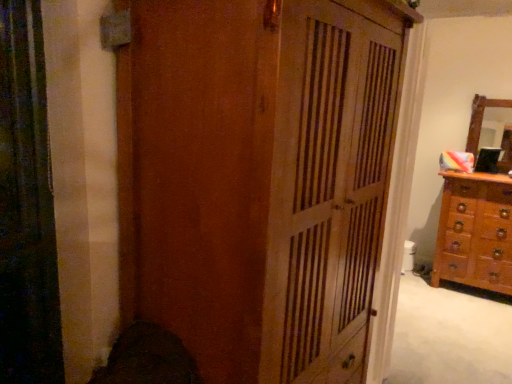
Question: From the image's perspective, is wooden mirror at right under wooden chest of drawers at right?

Choices:
 (A) yes
 (B) no

Answer: (B)

Question: Is wooden mirror at right positioned far away from wooden chest of drawers at right?

Choices:
 (A) no
 (B) yes

Answer: (A)

Question: Is wooden mirror at right positioned beyond the bounds of wooden chest of drawers at right?

Choices:
 (A) yes
 (B) no

Answer: (A)

Question: Can you confirm if wooden mirror at right is positioned to the right of wooden chest of drawers at right?

Choices:
 (A) yes
 (B) no

Answer: (A)

Question: Can you confirm if wooden mirror at right is thinner than wooden chest of drawers at right?

Choices:
 (A) no
 (B) yes

Answer: (B)

Question: Is wooden mirror at right with wooden chest of drawers at right?

Choices:
 (A) yes
 (B) no

Answer: (B)

Question: From a real-world perspective, does wooden chest of drawers at right sit lower than wooden mirror at right?

Choices:
 (A) no
 (B) yes

Answer: (B)

Question: Does wooden chest of drawers at right have a greater height compared to wooden mirror at right?

Choices:
 (A) yes
 (B) no

Answer: (A)

Question: Does wooden chest of drawers at right appear on the right side of wooden mirror at right?

Choices:
 (A) no
 (B) yes

Answer: (A)

Question: From a real-world perspective, is wooden chest of drawers at right physically above wooden mirror at right?

Choices:
 (A) yes
 (B) no

Answer: (B)

Question: Is wooden chest of drawers at right further to the viewer compared to wooden mirror at right?

Choices:
 (A) yes
 (B) no

Answer: (B)

Question: Considering the relative positions of wooden chest of drawers at right and wooden mirror at right in the image provided, is wooden chest of drawers at right to the left of wooden mirror at right from the viewer's perspective?

Choices:
 (A) yes
 (B) no

Answer: (A)

Question: From the image's perspective, is wooden mirror at right located above wooden cupboard at center?

Choices:
 (A) yes
 (B) no

Answer: (A)